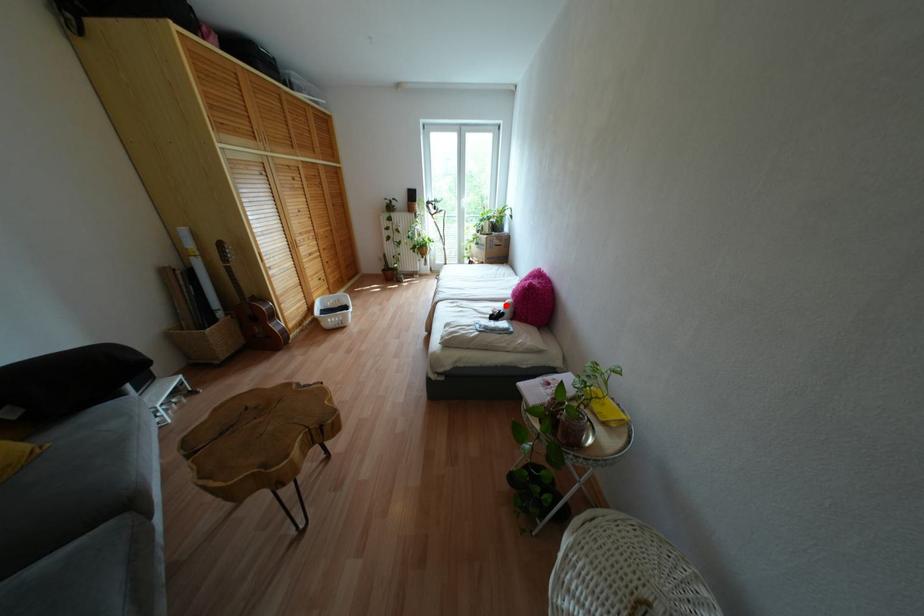
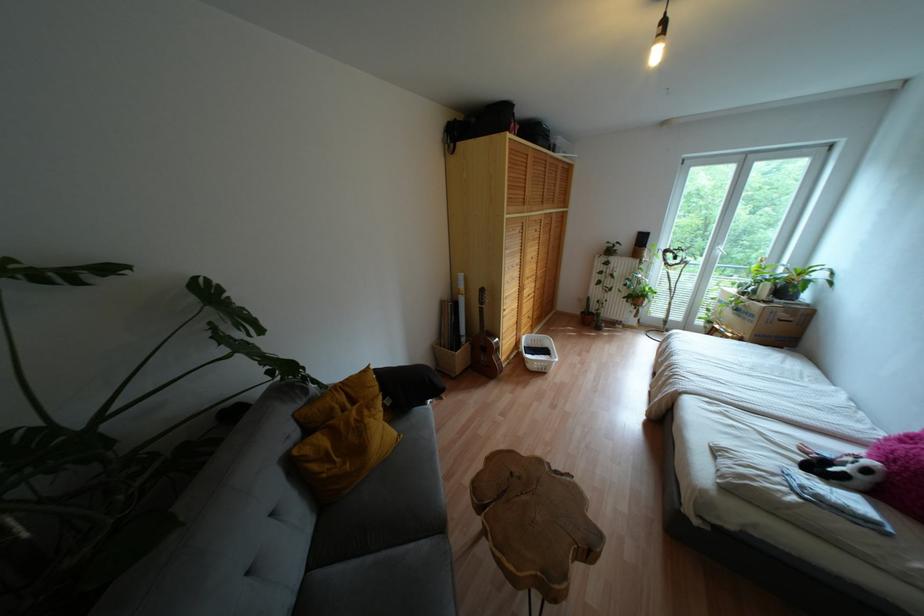
Question: I am providing you with two images of the same scene from different viewpoints. A red point is shown in image1. For the corresponding object point in image2, is it positioned nearer or farther from the camera?

Choices:
 (A) Nearer
 (B) Farther

Answer: (B)